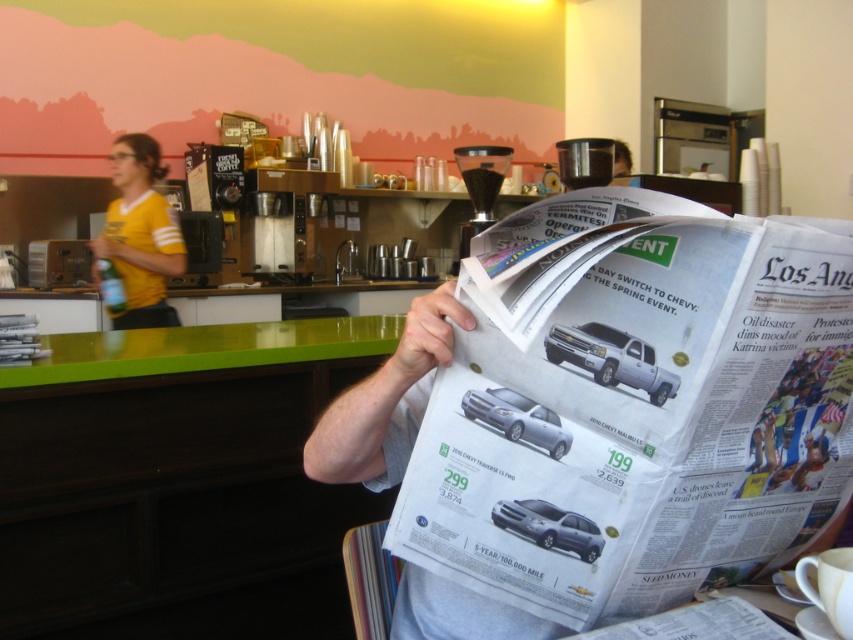
Which is more to the right, yellow jersey at left or metallic silver coffee machine at center?

metallic silver coffee machine at center

Which is behind, point (122, 276) or point (498, 179)?

Point (122, 276)

Is point (148, 225) farther from viewer compared to point (508, 150)?

Yes, point (148, 225) is farther from viewer.

Find the location of a particular element. yellow jersey at left is located at coordinates (140, 234).

Between white glossy newspaper at center and matte black newspaper at center, which one appears on the right side from the viewer's perspective?

From the viewer's perspective, matte black newspaper at center appears more on the right side.

Is white glossy newspaper at center bigger than matte black newspaper at center?

Yes.

Measure the distance between white glossy newspaper at center and camera.

white glossy newspaper at center is 24.16 inches from camera.

I want to click on white glossy newspaper at center, so click(625, 413).

Who is more distant from viewer, (x=125, y=288) or (x=630, y=164)?

The point (x=125, y=288) is behind.

Does yellow jersey at left have a smaller size compared to matte black newspaper at center?

No.

What are the coordinates of `yellow jersey at left` in the screenshot? It's located at (140, 234).